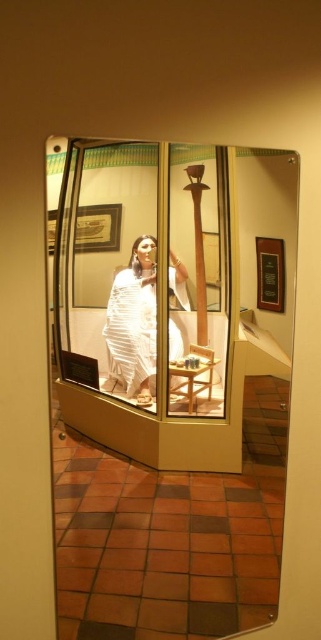
Based on the photo, can you confirm if clear glass mirror at center is positioned below white silk saree at center?

Indeed, clear glass mirror at center is positioned under white silk saree at center.

Which is in front, point (248, 460) or point (111, 364)?

Positioned in front is point (111, 364).

The width and height of the screenshot is (321, 640). Find the location of `clear glass mirror at center`. clear glass mirror at center is located at coordinates (170, 384).

You are a GUI agent. You are given a task and a screenshot of the screen. Output one action in this format:
    pyautogui.click(x=<x>, y=<y>)
    Task: Click on the clear glass mirror at center
    The width and height of the screenshot is (321, 640).
    Given the screenshot: What is the action you would take?
    pyautogui.click(x=170, y=384)